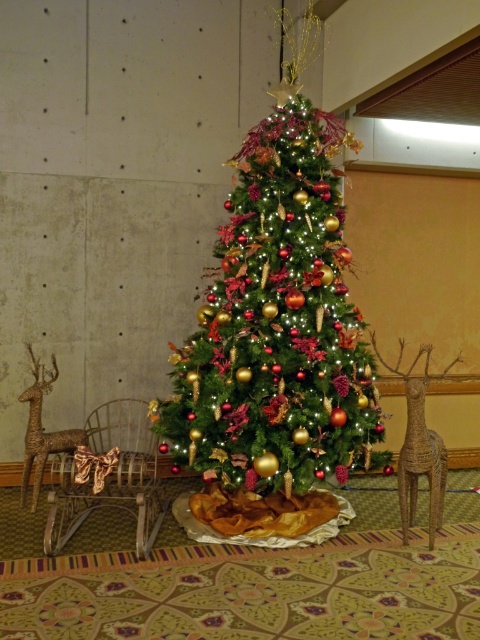
You are a delivery person trying to place a new ornament between the woven wood reindeer at right and the rustic brown deer at left. The ornament requires a space of 1.5 meters. Is there enough space between them to place the ornament?

The distance between the woven wood reindeer at right and rustic brown deer at left is 1.66 meters, which is more than the required 1.5 meters. Therefore, there is enough space to place the ornament between them.

In the scene shown: You are standing in front of the Christmas tree and want to place a new ornament exactly at the center of the tree. According to the image, where should you place it relative to the shiny gold ornaments at center?

The shiny gold ornaments at center are already located at the center of the tree, so placing the new ornament there would mean positioning it near the shiny gold ornaments at center at point (x=277, y=314).